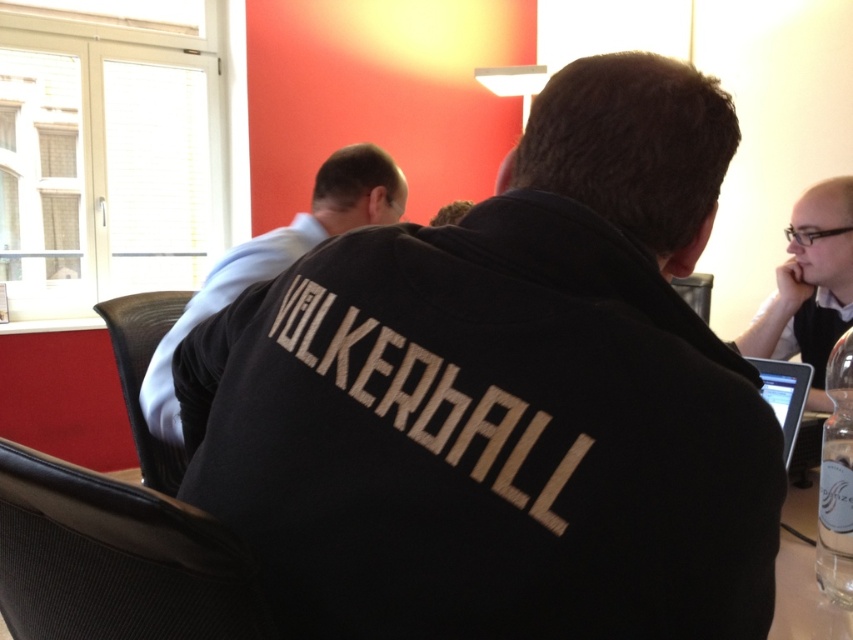
You are an office assistant who needs to deliver a document to the person wearing the white shirt at upper left. The document is on the matte black tablet at lower right. Can you directly hand it to them without moving the document?

The white shirt at upper left is to the left of the matte black tablet at lower right. Since the tablet is to the right of the shirt, the person wearing the white shirt at upper left can reach across to the right to retrieve the document from the matte black tablet at lower right without needing to move it.

You are standing at the entrance of the room and want to greet the person wearing the white shirt at upper left. According to the coordinates provided, where should you look to find them?

The white shirt at upper left is located at coordinates point (270, 273), so you should look towards that position to find them.

In the scene described, there is a point labeled as point [270,273]. Which object from the list corresponds to this point?

The point [270,273] corresponds to the white shirt at upper left.